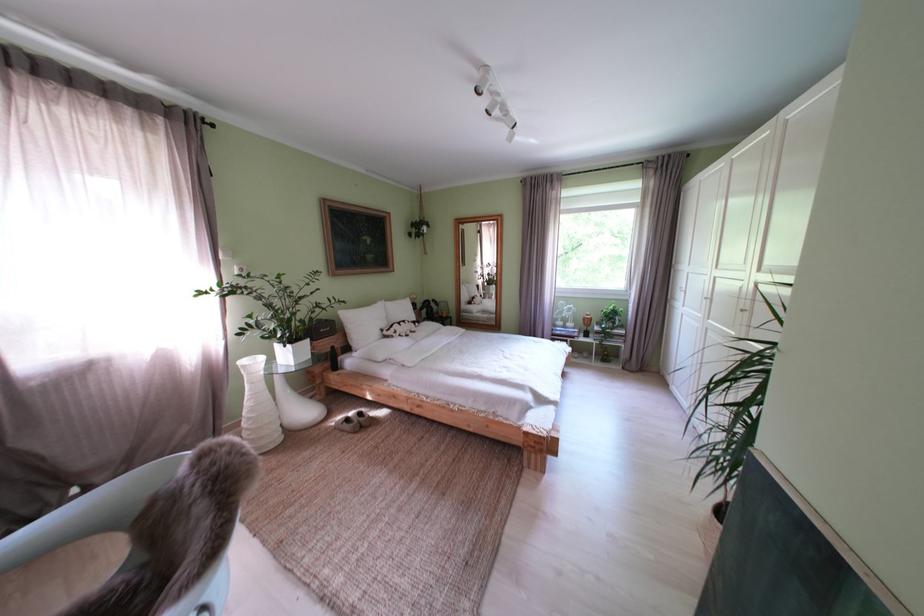
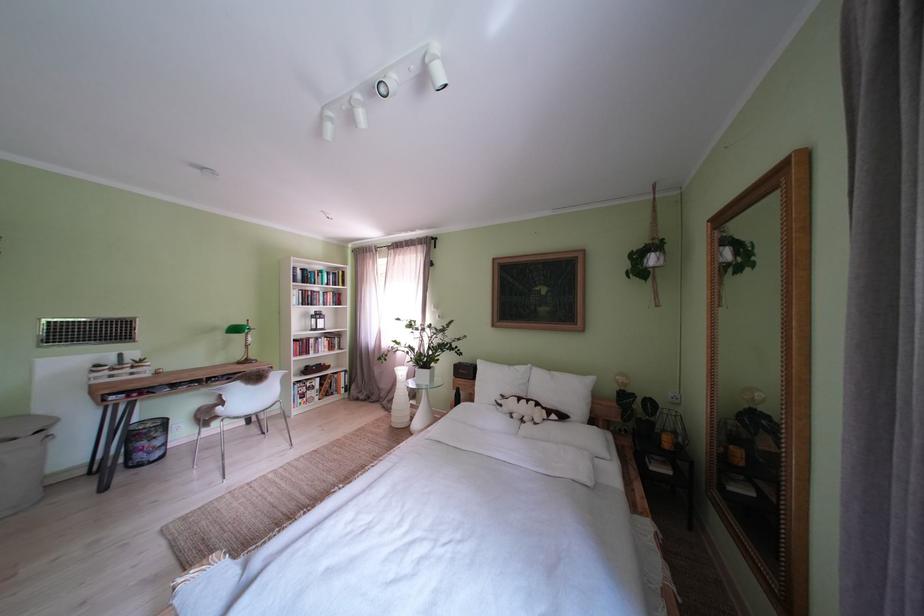
Locate, in the second image, the point that corresponds to point (373, 330) in the first image.

(500, 386)